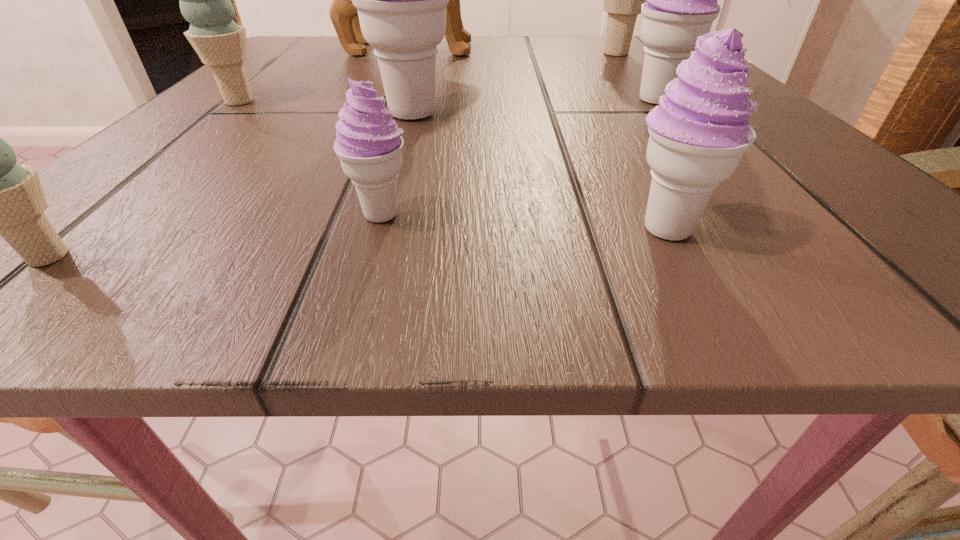
This screenshot has height=540, width=960. In order to click on ice cream located in the left edge section of the desktop in this screenshot , I will do `click(204, 0)`.

Where is `object at the far left corner`? object at the far left corner is located at coordinates (344, 15).

This screenshot has height=540, width=960. I want to click on object that is at the far right corner, so click(622, 0).

In the image, there is a desktop. Identify the location of blank space at the far edge. This screenshot has width=960, height=540. (581, 39).

Identify the location of vacant space at the near edge of the desktop. The height and width of the screenshot is (540, 960). (607, 242).

Find the location of `vacant space at the left edge of the desktop`. vacant space at the left edge of the desktop is located at coordinates (290, 73).

Where is `vacant region at the right edge`? The height and width of the screenshot is (540, 960). vacant region at the right edge is located at coordinates (768, 138).

The height and width of the screenshot is (540, 960). In the image, there is a desktop. Identify the location of free region at the far left corner. (326, 43).

The image size is (960, 540). Find the location of `vacant space at the near left corner`. vacant space at the near left corner is located at coordinates (175, 272).

Identify the location of vacant area that lies between the third ice cream from right to left and the second biggest blue ice cream. This screenshot has height=540, width=960. (452, 165).